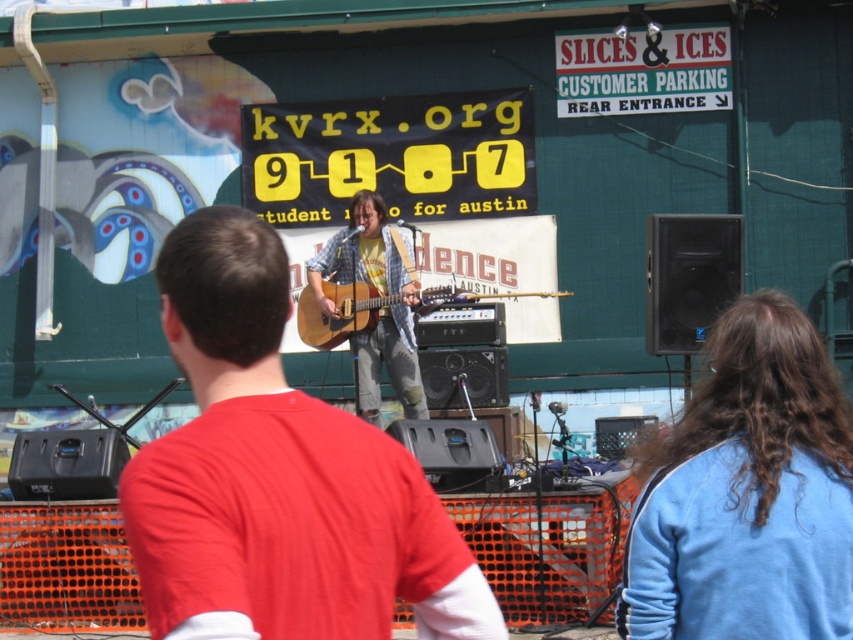
Can you confirm if matte brown guitar at center is bigger than acoustic wood guitar at center?

Actually, matte brown guitar at center might be smaller than acoustic wood guitar at center.

From the picture: Can you confirm if matte brown guitar at center is shorter than acoustic wood guitar at center?

No, matte brown guitar at center is not shorter than acoustic wood guitar at center.

Is point (424, 604) farther from camera compared to point (358, 298)?

That is False.

I want to click on matte brown guitar at center, so click(277, 477).

Looking at this image, who is positioned more to the right, matte yellow shirt at center or acoustic wood guitar at center?

From the viewer's perspective, acoustic wood guitar at center appears more on the right side.

Does matte yellow shirt at center have a greater width compared to acoustic wood guitar at center?

In fact, matte yellow shirt at center might be narrower than acoustic wood guitar at center.

Between point (349, 216) and point (329, 289), which one is positioned in front?

Point (329, 289) is in front.

This screenshot has width=853, height=640. Identify the location of matte yellow shirt at center. (381, 308).

Can you confirm if matte brown guitar at center is wider than matte yellow shirt at center?

No.

Is point (207, 205) less distant than point (416, 401)?

No, (207, 205) is behind (416, 401).

Image resolution: width=853 pixels, height=640 pixels. What do you see at coordinates (277, 477) in the screenshot?
I see `matte brown guitar at center` at bounding box center [277, 477].

Locate an element on the screen. The image size is (853, 640). matte brown guitar at center is located at coordinates (277, 477).